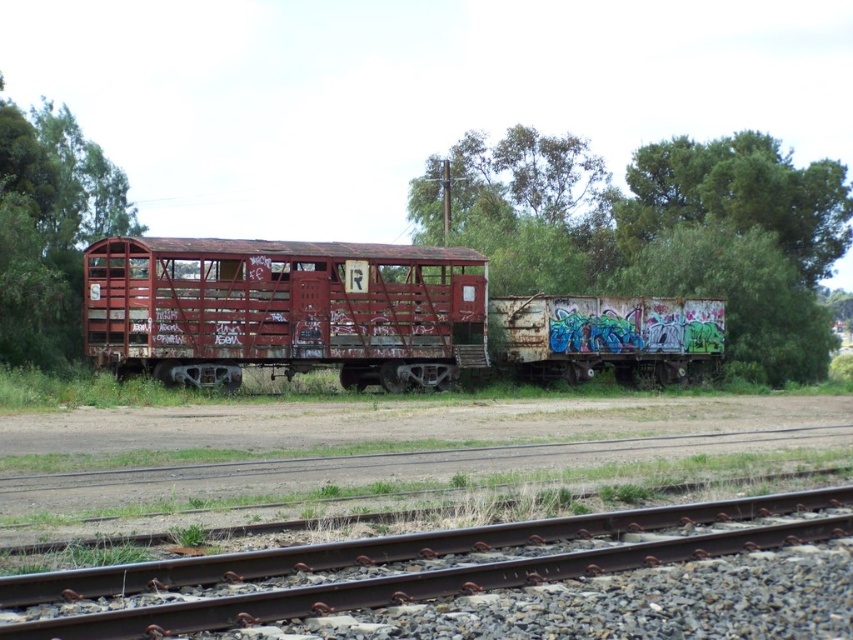
Consider the image. You are a photographer planning to capture the rusty metal train track at lower center and the green leafy tree at left in the same frame. Based on their heights, which object will appear taller in the photo?

The green leafy tree at left will appear taller in the photo because the rusty metal train track at lower center is not as tall as it.

You are a maintenance worker needing to inspect the rusty metal train car at center and the green leafy tree at left. Your tool kit is 35 feet away from the nearest point between them. Can you reach both objects without moving your toolkit?

The distance between the rusty metal train car at center and the green leafy tree at left is 30.02 feet. Since your toolkit is 35 feet away from the nearest point between them, you cannot reach both objects without moving your toolkit because the total distance required would exceed the toolkit reach.

You are a photographer planning to capture a landscape shot that includes both the rusty metal train car at center and the green leafy tree at left. Based on their heights, which object will appear smaller in the photo?

The rusty metal train car at center will appear smaller in the photo because it has a lesser height compared to the green leafy tree at left.